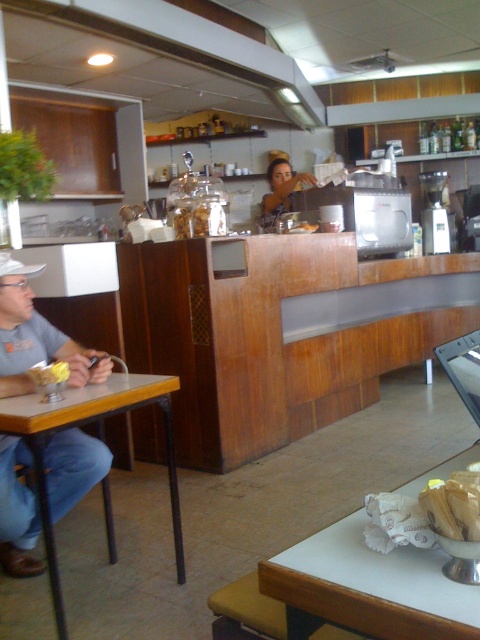
You are standing at the entrance of the diner and want to sit at the wooden table at left. Which direction should you walk to reach it?

Since the wooden table at left is located at point 0.662 on the x and 0.175 on the y axis, you should walk towards the left side of the diner to reach it.

You are a customer sitting at the table in the diner. You want to reach for the yellow matte butter at table left and the matte glass jar at center. Which item is closer to your right hand?

The matte glass jar at center is closer to your right hand because the yellow matte butter at table left is positioned to the left of it.